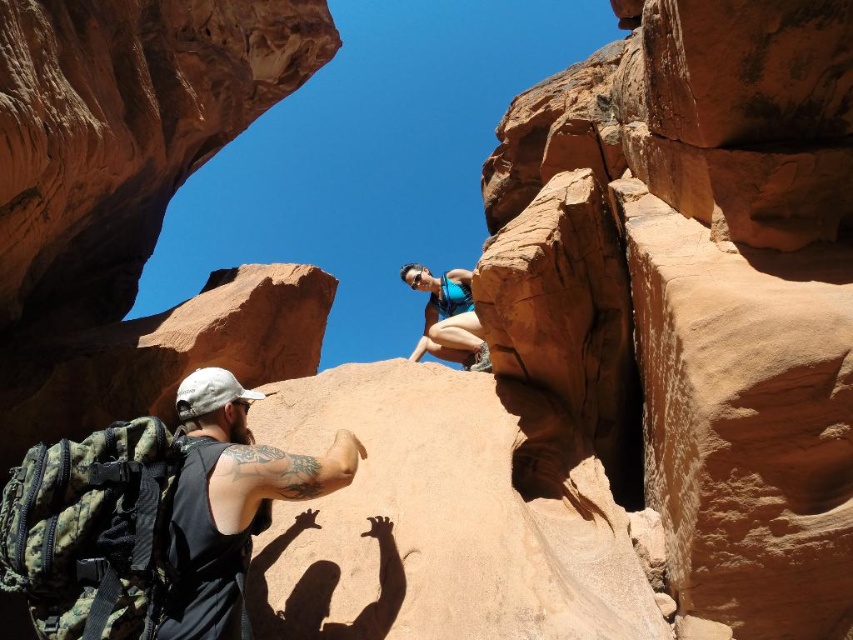
You are standing at the point labeled point (225, 410) and want to move towards the point labeled point (421, 356). Given that you can only walk forward in a straight line, will you pass by any other landmarks or obstacles before reaching your destination?

Since point (225, 410) is closer to the viewer than point (421, 356), moving straight ahead from your current position would mean you are already facing away from the destination. Therefore, you cannot reach point (421, 356) by walking forward in a straight line from your current position without turning around first.

In the scene shown: You are a hiker who wants to take a photo of the smooth sandstone rock at upper center without any obstructions. Is the camouflage backpack at lower left blocking your view of it?

The camouflage backpack at lower left is behind the smooth sandstone rock at upper center, so it is not blocking your view of the smooth sandstone rock at upper center.

You are a hiker who wants to place your camouflage backpack at lower left on the smooth sandstone rock at upper center. Is this possible given their positions?

The smooth sandstone rock at upper center is located above the camouflage backpack at lower left, so the backpack is already below the rock. You can place the camouflage backpack at lower left on the smooth sandstone rock at upper center since it is positioned above.